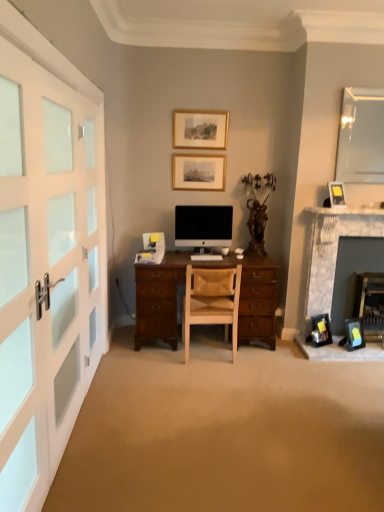
This screenshot has height=512, width=384. What are the coordinates of `white plastic keyboard at center` in the screenshot? It's located at (206, 258).

This screenshot has width=384, height=512. What do you see at coordinates (206, 258) in the screenshot? I see `white plastic keyboard at center` at bounding box center [206, 258].

Find the location of `white marble fireplace at right`. white marble fireplace at right is located at coordinates (337, 256).

This screenshot has height=512, width=384. In order to click on white plastic keyboard at center in this screenshot , I will do `click(206, 258)`.

Is matte gold picture frame at upper right, the 3th picture frame from the top, bigger than satin black monitor at center?

No.

From the image's perspective, relative to satin black monitor at center, is matte gold picture frame at upper right, which ranks as the 4th picture frame in left-to-right order, above or below?

Clearly, from the image's perspective, matte gold picture frame at upper right, which ranks as the 4th picture frame in left-to-right order, is above satin black monitor at center.

Considering the relative positions of matte gold picture frame at upper right, which is the 3th picture frame in bottom-to-top order, and satin black monitor at center in the image provided, is matte gold picture frame at upper right, which is the 3th picture frame in bottom-to-top order, to the right of satin black monitor at center from the viewer's perspective?

Correct, you'll find matte gold picture frame at upper right, which is the 3th picture frame in bottom-to-top order, to the right of satin black monitor at center.

Is matte gold picture frame at upper right, positioned as the 2th picture frame in right-to-left order, facing towards satin black monitor at center?

No, matte gold picture frame at upper right, positioned as the 2th picture frame in right-to-left order, is not aimed at satin black monitor at center.

Considering the positions of point (189, 183) and point (350, 324), is point (189, 183) closer or farther from the camera than point (350, 324)?

Point (189, 183) is positioned farther from the camera compared to point (350, 324).

Can you tell me how much matte gold picture frame at upper center, positioned as the fourth picture frame in bottom-to-top order, and matte black picture frame at lower right, arranged as the 5th picture frame when viewed from the top, differ in facing direction?

The angle between the facing direction of matte gold picture frame at upper center, positioned as the fourth picture frame in bottom-to-top order, and the facing direction of matte black picture frame at lower right, arranged as the 5th picture frame when viewed from the top, is 27.7 degrees.

Considering the positions of objects matte gold picture frame at upper center, which ranks as the fifth picture frame in right-to-left order, and matte black picture frame at lower right, which ranks as the first picture frame in bottom-to-top order, in the image provided, who is in front, matte gold picture frame at upper center, which ranks as the fifth picture frame in right-to-left order, or matte black picture frame at lower right, which ranks as the first picture frame in bottom-to-top order,?

Positioned in front is matte black picture frame at lower right, which ranks as the first picture frame in bottom-to-top order.

How different are the orientations of matte black picture frame at lower right, which appears as the 2th picture frame when ordered from the bottom, and satin black monitor at center in degrees?

There is a 29.6-degree angle between the facing directions of matte black picture frame at lower right, which appears as the 2th picture frame when ordered from the bottom, and satin black monitor at center.

You are a GUI agent. You are given a task and a screenshot of the screen. Output one action in this format:
    pyautogui.click(x=<x>, y=<y>)
    Task: Click on the 1st picture frame below when counting from the satin black monitor at center (from the image's perspective)
    The width and height of the screenshot is (384, 512).
    Given the screenshot: What is the action you would take?
    pyautogui.click(x=320, y=331)

Looking at this image, is matte black picture frame at lower right, which is the fourth picture frame from top to bottom, not near satin black monitor at center?

Indeed, matte black picture frame at lower right, which is the fourth picture frame from top to bottom, is not near satin black monitor at center.

Which of these two, matte black picture frame at lower right, the third picture frame viewed from the left, or satin black monitor at center, stands taller?

satin black monitor at center is taller.

Which object is further away from the camera taking this photo, matte gold picture frame at upper right, positioned as the 2th picture frame in right-to-left order, or white frosted glass doors at left?

matte gold picture frame at upper right, positioned as the 2th picture frame in right-to-left order, is further away from the camera.

Is matte gold picture frame at upper right, positioned as the 2th picture frame in right-to-left order, turned away from white frosted glass doors at left?

matte gold picture frame at upper right, positioned as the 2th picture frame in right-to-left order, does not have its back to white frosted glass doors at left.

Is matte gold picture frame at upper right, which ranks as the 4th picture frame in left-to-right order, not close to white frosted glass doors at left?

That's right, there is a large distance between matte gold picture frame at upper right, which ranks as the 4th picture frame in left-to-right order, and white frosted glass doors at left.

Is matte gold picture frame at upper right, positioned as the 2th picture frame in right-to-left order, taller or shorter than white frosted glass doors at left?

Clearly, matte gold picture frame at upper right, positioned as the 2th picture frame in right-to-left order, is shorter compared to white frosted glass doors at left.

Can you tell me how much gold-framed picture at upper center, which is the 4th picture frame from right to left, and matte black picture frame at lower right, arranged as the 5th picture frame when viewed from the top, differ in facing direction?

The angular difference between gold-framed picture at upper center, which is the 4th picture frame from right to left, and matte black picture frame at lower right, arranged as the 5th picture frame when viewed from the top, is 28.1 degrees.

Is gold-framed picture at upper center, which ranks as the 2th picture frame in left-to-right order, not close to matte black picture frame at lower right, which is counted as the first picture frame, starting from the right?

Yes, gold-framed picture at upper center, which ranks as the 2th picture frame in left-to-right order, is far from matte black picture frame at lower right, which is counted as the first picture frame, starting from the right.

From the image's perspective, is gold-framed picture at upper center, which is counted as the first picture frame, starting from the top, below matte black picture frame at lower right, the 5th picture frame viewed from the left?

No.

From a real-world perspective, which is physically above, matte black picture frame at lower right, the 3th picture frame positioned from the right, or white marble fireplace at right?

From a 3D spatial view, white marble fireplace at right is above.

Is matte black picture frame at lower right, the 3th picture frame positioned from the right, situated inside white marble fireplace at right or outside?

matte black picture frame at lower right, the 3th picture frame positioned from the right, is spatially positioned inside white marble fireplace at right.

Considering the relative sizes of matte black picture frame at lower right, the third picture frame viewed from the left, and white marble fireplace at right in the image provided, is matte black picture frame at lower right, the third picture frame viewed from the left, smaller than white marble fireplace at right?

Yes, matte black picture frame at lower right, the third picture frame viewed from the left, is smaller than white marble fireplace at right.

Which is in front, point (324, 333) or point (380, 223)?

The point (324, 333) is more forward.

Are satin black monitor at center and matte black picture frame at lower right, the third picture frame viewed from the left, making contact?

No.

Is satin black monitor at center not inside matte black picture frame at lower right, which appears as the 2th picture frame when ordered from the bottom?

satin black monitor at center is positioned outside matte black picture frame at lower right, which appears as the 2th picture frame when ordered from the bottom.

Between satin black monitor at center and matte black picture frame at lower right, which is the fourth picture frame from top to bottom, which one is positioned in front?

Positioned in front is matte black picture frame at lower right, which is the fourth picture frame from top to bottom.

From a real-world perspective, which picture frame is the 1st one above the satin black monitor at center? Please provide its 2D coordinates.

[(336, 194)]

From the image's perspective, count 3rd picture frames upward from the matte black picture frame at lower right, which is counted as the first picture frame, starting from the right, and point to it. Please provide its 2D coordinates.

[(198, 172)]

When comparing their distances from clear glass mirror at upper right, does white plastic keyboard at center or satin black monitor at center seem closer?

satin black monitor at center is closer to clear glass mirror at upper right.

From the image, which object appears to be nearer to white frosted glass doors at left, clear glass mirror at upper right or matte gold picture frame at upper center, which is the 1th picture frame from left to right?

The object closer to white frosted glass doors at left is matte gold picture frame at upper center, which is the 1th picture frame from left to right.

Considering their positions, is white plastic keyboard at center positioned closer to matte black picture frame at lower right, arranged as the 5th picture frame when viewed from the top, than satin black monitor at center?

white plastic keyboard at center is closer to matte black picture frame at lower right, arranged as the 5th picture frame when viewed from the top.

From the image, which object appears to be nearer to matte gold picture frame at upper center, placed as the second picture frame when sorted from top to bottom, white frosted glass doors at left or leather at center?

leather at center lies closer to matte gold picture frame at upper center, placed as the second picture frame when sorted from top to bottom, than the other object.

Looking at the image, which one is located closer to matte black picture frame at lower right, which is counted as the first picture frame, starting from the right, gold-framed picture at upper center, which is the 4th picture frame from right to left, or white frosted glass doors at left?

gold-framed picture at upper center, which is the 4th picture frame from right to left, is closer to matte black picture frame at lower right, which is counted as the first picture frame, starting from the right.

When comparing their distances from matte gold picture frame at upper right, which is the 3th picture frame in bottom-to-top order, does gold-framed picture at upper center, which ranks as the 2th picture frame in left-to-right order, or white frosted glass doors at left seem closer?

gold-framed picture at upper center, which ranks as the 2th picture frame in left-to-right order, lies closer to matte gold picture frame at upper right, which is the 3th picture frame in bottom-to-top order, than the other object.

Looking at the image, which one is located further to gold-framed picture at upper center, which is counted as the first picture frame, starting from the top, white marble fireplace at right or leather at center?

leather at center is further to gold-framed picture at upper center, which is counted as the first picture frame, starting from the top.

Which object lies further to the anchor point clear glass mirror at upper right, matte gold picture frame at upper right, which is the 3th picture frame in bottom-to-top order, or matte gold picture frame at upper center, which ranks as the fifth picture frame in right-to-left order?

Among the two, matte gold picture frame at upper center, which ranks as the fifth picture frame in right-to-left order, is located further to clear glass mirror at upper right.

Find the location of `computer keyboard between satin black monitor at center and leather at center in the vertical direction`. computer keyboard between satin black monitor at center and leather at center in the vertical direction is located at coordinates (206, 258).

Where is `chair between clear glass mirror at upper right and matte black picture frame at lower right, which is the fourth picture frame from top to bottom, vertically`? This screenshot has height=512, width=384. chair between clear glass mirror at upper right and matte black picture frame at lower right, which is the fourth picture frame from top to bottom, vertically is located at coordinates (211, 301).

This screenshot has width=384, height=512. Find the location of `chair between white plastic keyboard at center and matte black picture frame at lower right, which appears as the 2th picture frame when ordered from the bottom, in the horizontal direction`. chair between white plastic keyboard at center and matte black picture frame at lower right, which appears as the 2th picture frame when ordered from the bottom, in the horizontal direction is located at coordinates (211, 301).

This screenshot has height=512, width=384. Identify the location of fireplace between gold-framed picture at upper center, which is counted as the first picture frame, starting from the top, and leather at center, in the vertical direction. (337, 256).